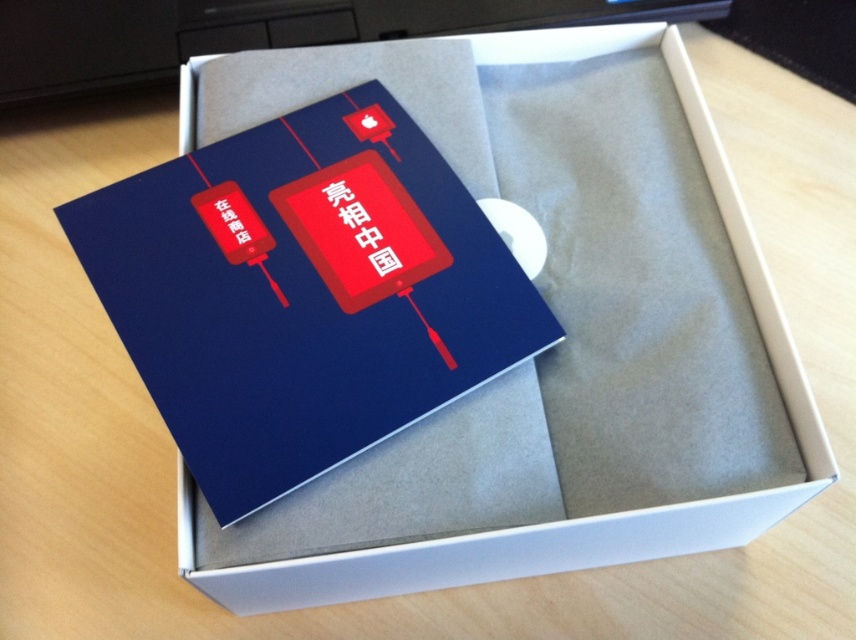
Question: Is blue cardboard box at center thinner than matte blue card at center?

Choices:
 (A) no
 (B) yes

Answer: (A)

Question: Observing the image, what is the correct spatial positioning of blue cardboard box at center in reference to matte blue card at center?

Choices:
 (A) below
 (B) above

Answer: (A)

Question: Which point is farther to the camera?

Choices:
 (A) blue cardboard box at center
 (B) matte blue card at center

Answer: (B)

Question: Is blue cardboard box at center behind matte blue card at center?

Choices:
 (A) no
 (B) yes

Answer: (A)